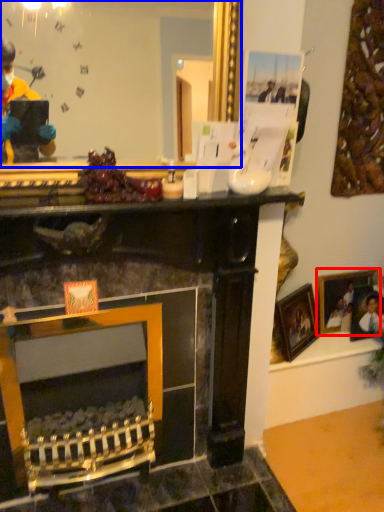
Question: Which object is closer to the camera taking this photo, picture frame (highlighted by a red box) or mirror (highlighted by a blue box)?

Choices:
 (A) picture frame
 (B) mirror

Answer: (B)